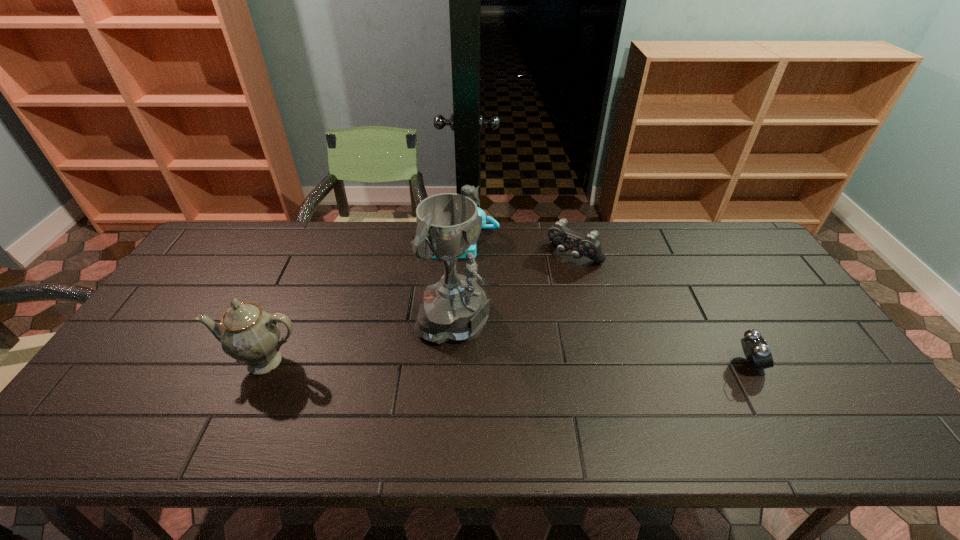
This screenshot has width=960, height=540. In order to click on free region located on the dial of the telephone in this screenshot , I will do `click(457, 331)`.

Identify the location of free space located 0.200m on the dial of the telephone. This screenshot has width=960, height=540. (458, 302).

Image resolution: width=960 pixels, height=540 pixels. I want to click on vacant space situated on the dial of the telephone, so click(x=458, y=300).

Where is `vacant area situated 0.140m on the side with emblem of the award`? The image size is (960, 540). vacant area situated 0.140m on the side with emblem of the award is located at coordinates (537, 364).

Find the location of a particular element. This screenshot has height=540, width=960. free spot located 0.210m on the side with emblem of the award is located at coordinates (562, 376).

At what (x,y) coordinates should I click in order to perform the action: click on vacant space located 0.370m on the side with emblem of the award. Please return your answer as a coordinate pair (x, y). Looking at the image, I should click on (624, 407).

Where is `control that is at the far edge`? The image size is (960, 540). control that is at the far edge is located at coordinates [x=589, y=245].

This screenshot has width=960, height=540. I want to click on telephone that is at the far edge, so click(x=495, y=225).

Locate an element on the screen. Image resolution: width=960 pixels, height=540 pixels. object that is at the near edge is located at coordinates (248, 334).

In the image, there is a desktop. Identify the location of blank space at the far edge. This screenshot has height=540, width=960. pyautogui.click(x=624, y=226).